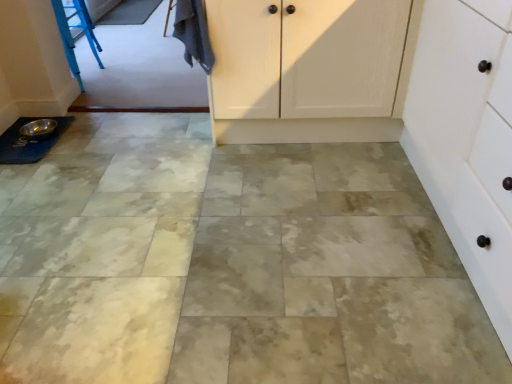
Question: Is silver metallic bowl at lower left with dark gray fabric at upper left?

Choices:
 (A) yes
 (B) no

Answer: (B)

Question: From a real-world perspective, is silver metallic bowl at lower left on dark gray fabric at upper left?

Choices:
 (A) yes
 (B) no

Answer: (B)

Question: Is silver metallic bowl at lower left to the right of dark gray fabric at upper left from the viewer's perspective?

Choices:
 (A) yes
 (B) no

Answer: (B)

Question: From a real-world perspective, is silver metallic bowl at lower left under dark gray fabric at upper left?

Choices:
 (A) yes
 (B) no

Answer: (A)

Question: Is silver metallic bowl at lower left positioned behind dark gray fabric at upper left?

Choices:
 (A) no
 (B) yes

Answer: (B)

Question: Is dark gray fabric at upper left inside or outside of silver metallic bowl at lower left?

Choices:
 (A) inside
 (B) outside

Answer: (B)

Question: Considering the positions of point (165, 21) and point (17, 144), is point (165, 21) closer or farther from the camera than point (17, 144)?

Choices:
 (A) closer
 (B) farther

Answer: (B)

Question: From their relative heights in the image, would you say dark gray fabric at upper left is taller or shorter than silver metallic bowl at lower left?

Choices:
 (A) short
 (B) tall

Answer: (B)

Question: Visually, is dark gray fabric at upper left positioned to the left or to the right of silver metallic bowl at lower left?

Choices:
 (A) left
 (B) right

Answer: (B)

Question: Is white matte cabinet at right inside or outside of silver metallic bowl at lower left?

Choices:
 (A) outside
 (B) inside

Answer: (A)

Question: Based on their positions, is white matte cabinet at right located to the left or right of silver metallic bowl at lower left?

Choices:
 (A) left
 (B) right

Answer: (B)

Question: From a real-world perspective, is white matte cabinet at right physically located above or below silver metallic bowl at lower left?

Choices:
 (A) below
 (B) above

Answer: (B)

Question: In terms of size, does white matte cabinet at right appear bigger or smaller than silver metallic bowl at lower left?

Choices:
 (A) small
 (B) big

Answer: (B)

Question: Considering the positions of dark gray fabric at upper left and white matte cabinet at right in the image, is dark gray fabric at upper left taller or shorter than white matte cabinet at right?

Choices:
 (A) tall
 (B) short

Answer: (B)

Question: Is point (192, 0) positioned closer to the camera than point (439, 182)?

Choices:
 (A) closer
 (B) farther

Answer: (B)